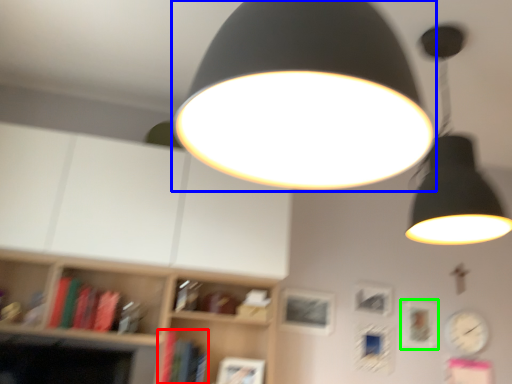
Question: Which is nearer to the book (highlighted by a red box)? lamp (highlighted by a blue box) or picture frame (highlighted by a green box).

Choices:
 (A) lamp
 (B) picture frame

Answer: (B)